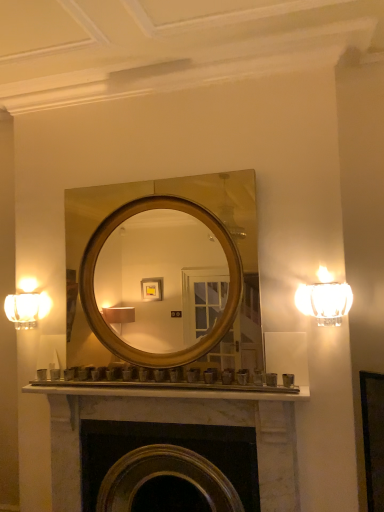
Question: Considering the relative sizes of clear glass sconce at right and marble fireplace at center in the image provided, is clear glass sconce at right bigger than marble fireplace at center?

Choices:
 (A) no
 (B) yes

Answer: (A)

Question: Does clear glass sconce at right have a lesser width compared to marble fireplace at center?

Choices:
 (A) yes
 (B) no

Answer: (A)

Question: Can you confirm if clear glass sconce at right is positioned to the right of marble fireplace at center?

Choices:
 (A) no
 (B) yes

Answer: (B)

Question: Are clear glass sconce at right and marble fireplace at center beside each other?

Choices:
 (A) yes
 (B) no

Answer: (B)

Question: Could you tell me if clear glass sconce at right is facing marble fireplace at center?

Choices:
 (A) yes
 (B) no

Answer: (B)

Question: Considering the relative sizes of clear glass sconce at right and marble fireplace at center in the image provided, is clear glass sconce at right smaller than marble fireplace at center?

Choices:
 (A) yes
 (B) no

Answer: (A)

Question: Does gold/metallic mirror at center have a greater height compared to matte glass sconce at left?

Choices:
 (A) yes
 (B) no

Answer: (A)

Question: Is gold/metallic mirror at center facing away from matte glass sconce at left?

Choices:
 (A) no
 (B) yes

Answer: (A)

Question: Considering the relative sizes of gold/metallic mirror at center and matte glass sconce at left in the image provided, is gold/metallic mirror at center smaller than matte glass sconce at left?

Choices:
 (A) yes
 (B) no

Answer: (B)

Question: Is gold/metallic mirror at center further to the viewer compared to matte glass sconce at left?

Choices:
 (A) no
 (B) yes

Answer: (A)

Question: From the image's perspective, does gold/metallic mirror at center appear lower than matte glass sconce at left?

Choices:
 (A) no
 (B) yes

Answer: (A)

Question: Can you confirm if gold/metallic mirror at center is wider than matte glass sconce at left?

Choices:
 (A) yes
 (B) no

Answer: (A)

Question: Considering the relative sizes of marble fireplace at center and matte glass sconce at left in the image provided, is marble fireplace at center taller than matte glass sconce at left?

Choices:
 (A) yes
 (B) no

Answer: (A)